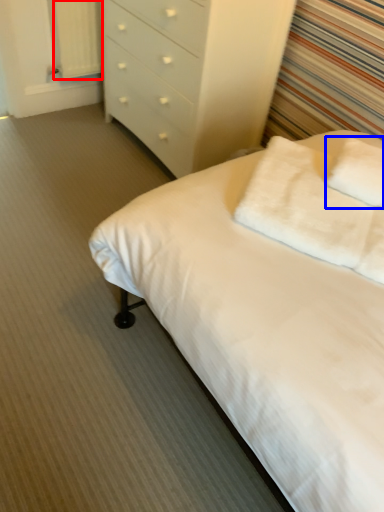
Question: Which point is further to the camera, curtain (highlighted by a red box) or pillow (highlighted by a blue box)?

Choices:
 (A) curtain
 (B) pillow

Answer: (A)